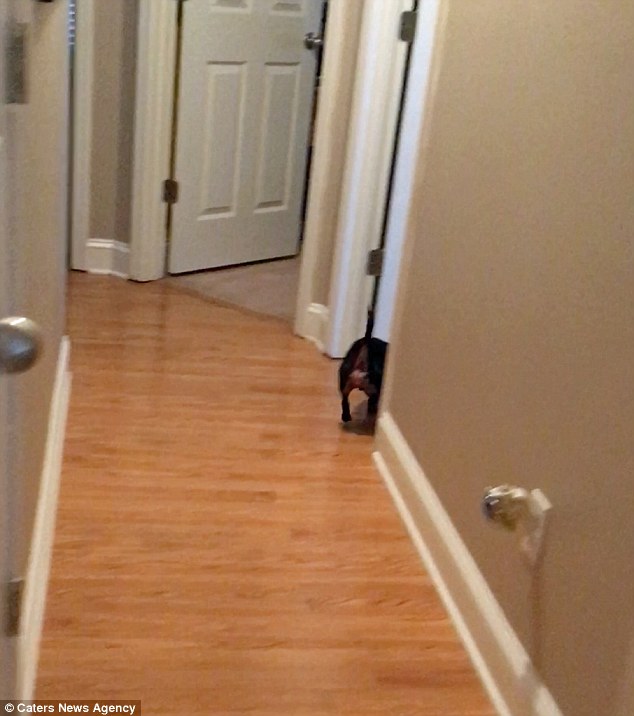
The image size is (634, 716). I want to click on door handle, so click(16, 354), click(316, 38).